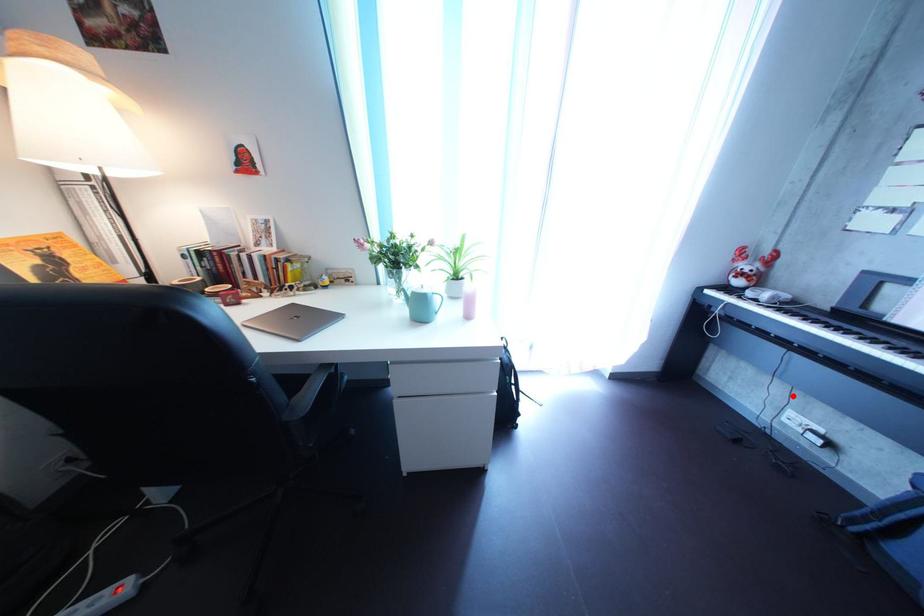
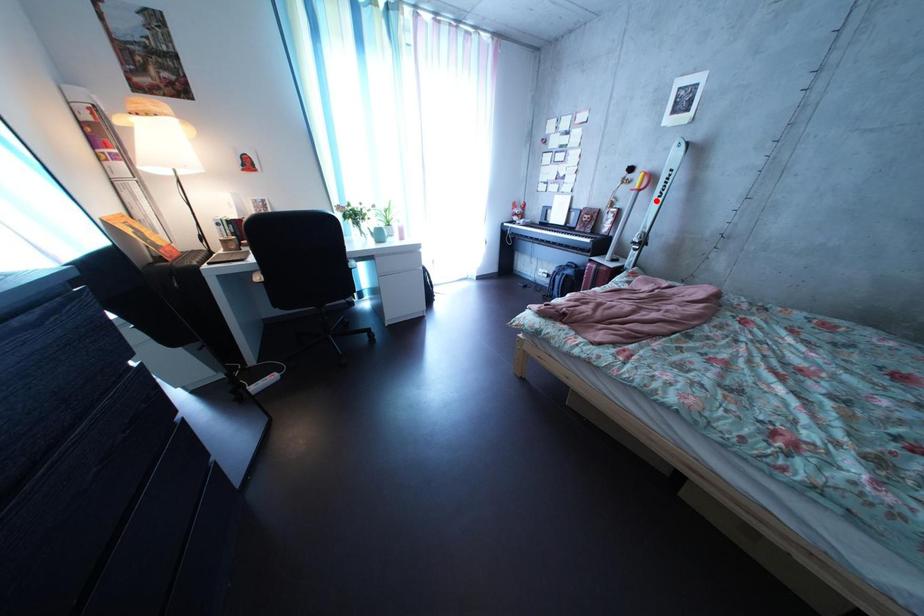
I am providing you with two images of the same scene from different viewpoints. A red point is marked on the first image and another point is marked on the second image. Is the red point in image1 aligned with the point shown in image2?

No